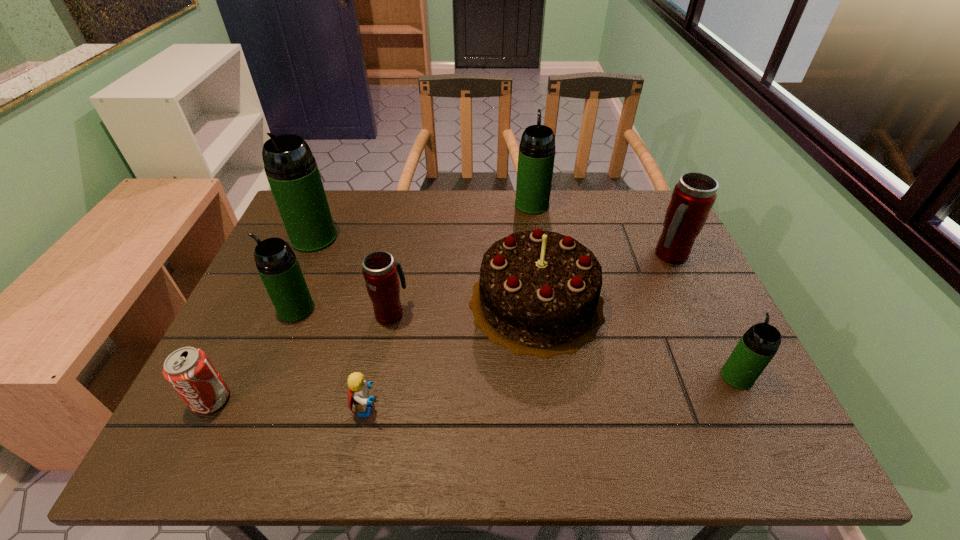
In the image, there is a desktop. Find the location of `vacant area at the near edge`. vacant area at the near edge is located at coordinates (379, 439).

At what (x,y) coordinates should I click in order to perform the action: click on free space at the left edge of the desktop. Please return your answer as a coordinate pair (x, y). This screenshot has height=540, width=960. Looking at the image, I should click on (275, 382).

Where is `vacant space at the right edge`? Image resolution: width=960 pixels, height=540 pixels. vacant space at the right edge is located at coordinates (674, 318).

Locate an element on the screen. free space at the near left corner of the desktop is located at coordinates (227, 443).

The height and width of the screenshot is (540, 960). In the image, there is a desktop. What are the coordinates of `vacant space at the far right corner` in the screenshot? It's located at (618, 205).

Find the location of a particular element. The height and width of the screenshot is (540, 960). vacant region at the near right corner of the desktop is located at coordinates (727, 450).

You are a GUI agent. You are given a task and a screenshot of the screen. Output one action in this format:
    pyautogui.click(x=<x>, y=<y>)
    Task: Click on the vacant area between the third thermos bottle from left to right and the tallest object
    
    Given the screenshot: What is the action you would take?
    pyautogui.click(x=352, y=275)

Where is `blank region between the nearest green thermos bottle and the shortest object`? Image resolution: width=960 pixels, height=540 pixels. blank region between the nearest green thermos bottle and the shortest object is located at coordinates (552, 392).

Locate an element on the screen. The image size is (960, 540). unoccupied position between the rightmost green thermos bottle and the second biggest green thermos bottle is located at coordinates (635, 291).

Image resolution: width=960 pixels, height=540 pixels. I want to click on empty location between the shortest object and the nearer red thermos bottle, so click(x=379, y=360).